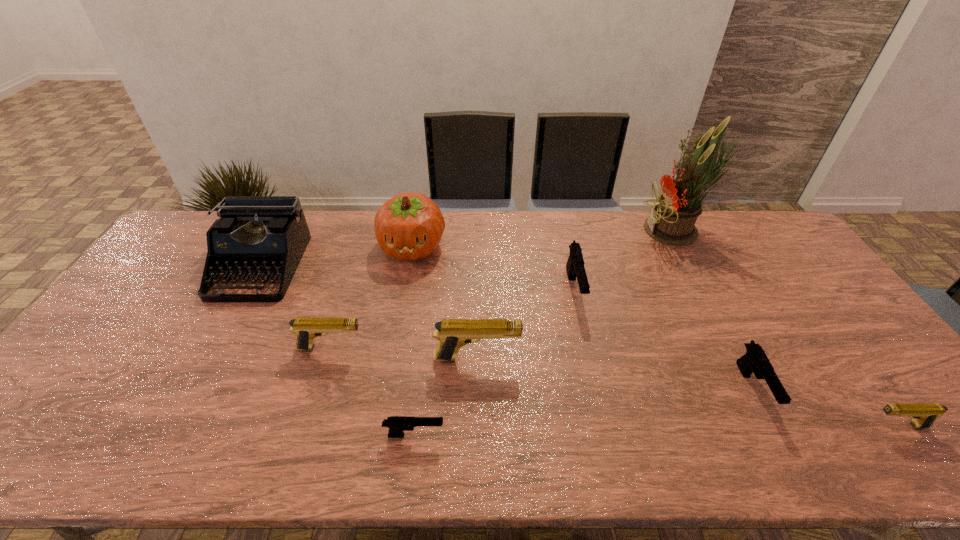
Locate an element on the screen. The width and height of the screenshot is (960, 540). free space that satisfies the following two spatial constraints: 1. on the side of the green pumpkin with the cute face; 2. at the barrel of the farthest tan pistol is located at coordinates (395, 348).